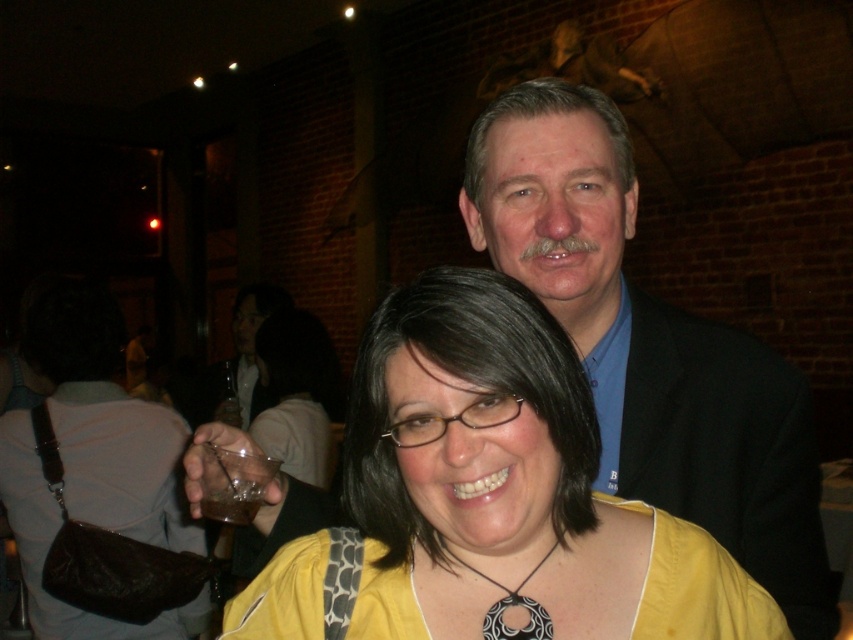
How much distance is there between blue smooth shirt at upper center and clear plastic cup at lower center?

A distance of 19.21 inches exists between blue smooth shirt at upper center and clear plastic cup at lower center.

Can you confirm if blue smooth shirt at upper center is shorter than clear plastic cup at lower center?

In fact, blue smooth shirt at upper center may be taller than clear plastic cup at lower center.

The image size is (853, 640). I want to click on blue smooth shirt at upper center, so click(650, 346).

Describe the element at coordinates (233, 483) in the screenshot. I see `clear plastic cup at lower center` at that location.

Does clear plastic cup at lower center come in front of translucent plastic cup at lower left?

Yes.

Between point (213, 464) and point (212, 504), which one is positioned behind?

Point (212, 504)

Find the location of a particular element. Image resolution: width=853 pixels, height=640 pixels. clear plastic cup at lower center is located at coordinates (233, 483).

Between yellow matte shirt at center and black matte/porcelain pendant at center, which one has less height?

With less height is black matte/porcelain pendant at center.

Who is positioned more to the right, yellow matte shirt at center or black matte/porcelain pendant at center?

Positioned to the right is yellow matte shirt at center.

Describe the element at coordinates (509, 484) in the screenshot. The width and height of the screenshot is (853, 640). I see `yellow matte shirt at center` at that location.

The height and width of the screenshot is (640, 853). I want to click on yellow matte shirt at center, so click(509, 484).